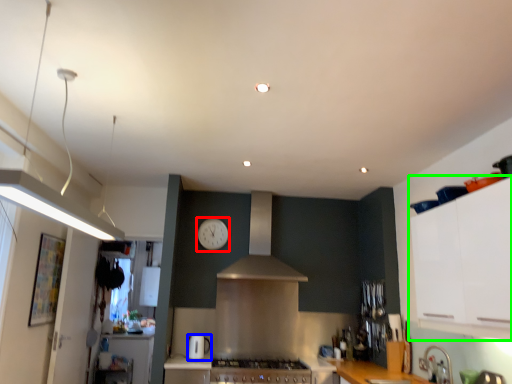
Question: Based on their relative distances, which object is farther from clock (highlighted by a red box)? Choose from kitchen appliance (highlighted by a blue box) and cabinetry (highlighted by a green box).

Choices:
 (A) kitchen appliance
 (B) cabinetry

Answer: (B)